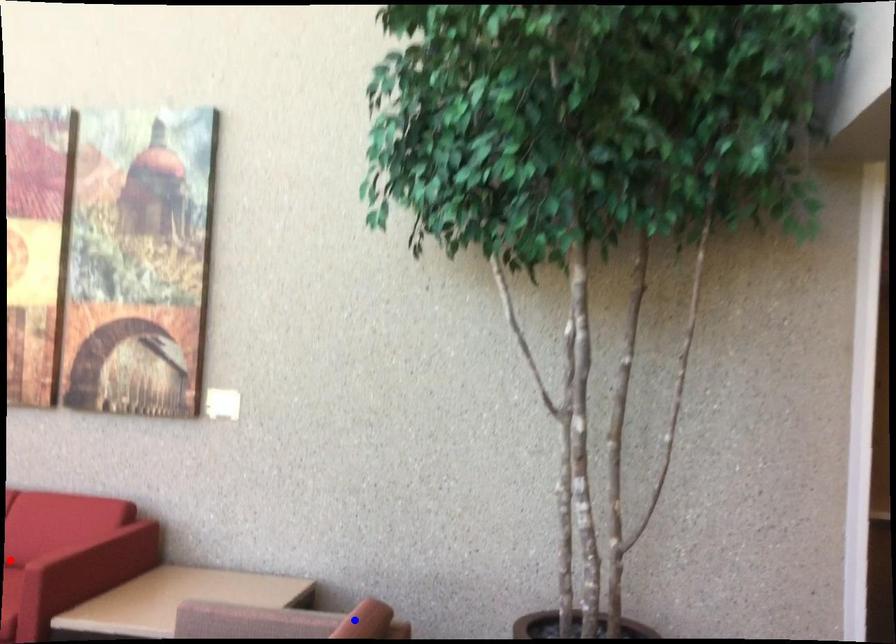
Question: In the image, two points are highlighted. Which point is nearer to the camera? Reply with the corresponding letter.

Choices:
 (A) blue point
 (B) red point

Answer: (A)